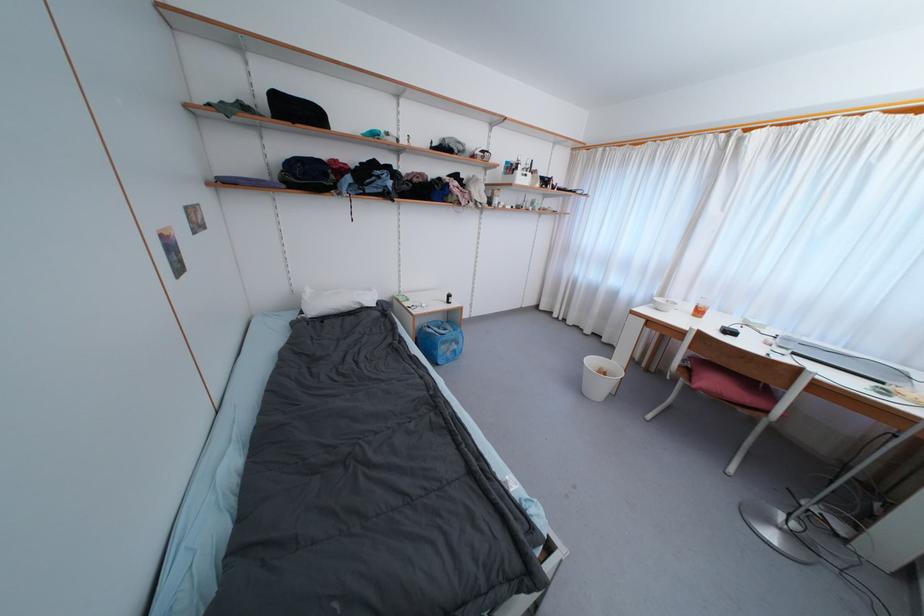
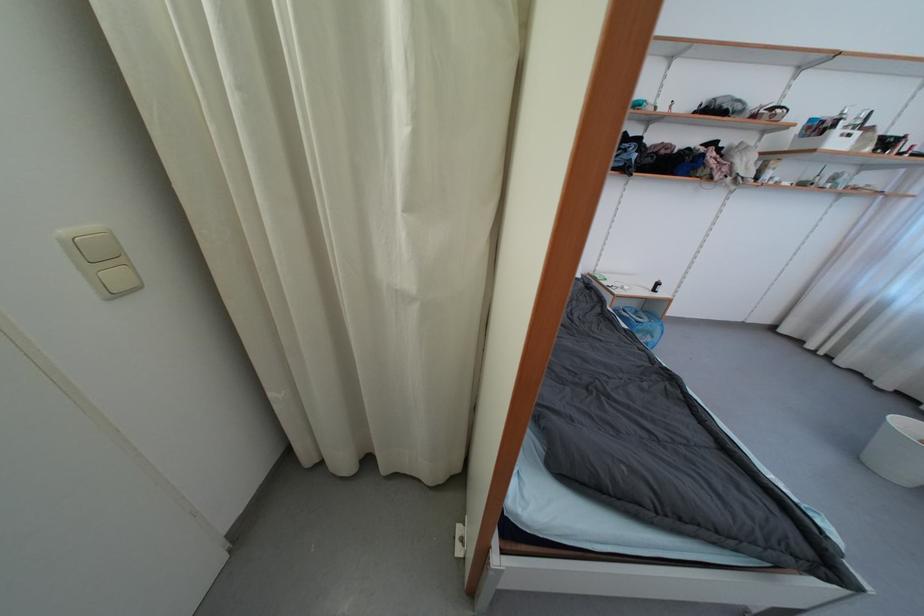
The point at (596, 363) is marked in the first image. Where is the corresponding point in the second image?

(912, 428)